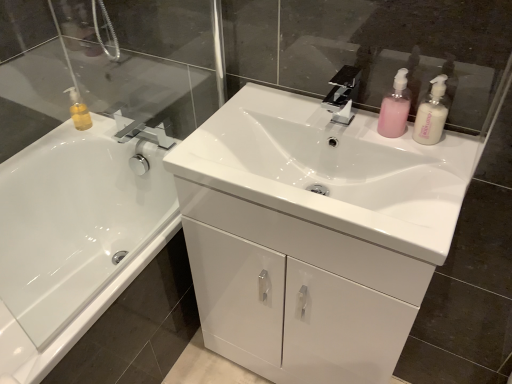
Question: Should I look upward or downward to see pink plastic pump bottle at upper right, marked as the 1th toiletry in a right-to-left arrangement?

Choices:
 (A) down
 (B) up

Answer: (B)

Question: Is white glossy sink at center facing towards black glossy faucet at center?

Choices:
 (A) yes
 (B) no

Answer: (B)

Question: Would you say black glossy faucet at center is part of white glossy sink at center's contents?

Choices:
 (A) no
 (B) yes

Answer: (A)

Question: Would you say white glossy sink at center is outside black glossy faucet at center?

Choices:
 (A) no
 (B) yes

Answer: (B)

Question: Considering the relative positions of white glossy sink at center and black glossy faucet at center in the image provided, is white glossy sink at center behind black glossy faucet at center?

Choices:
 (A) no
 (B) yes

Answer: (A)

Question: Is the surface of white glossy sink at center in direct contact with black glossy faucet at center?

Choices:
 (A) yes
 (B) no

Answer: (B)

Question: Is white glossy sink at center closer to camera compared to black glossy faucet at center?

Choices:
 (A) no
 (B) yes

Answer: (B)

Question: From the image's perspective, is white glossy bathtub at left located above pink matte pump bottle at upper right, which appears as the second toiletry when viewed from the back?

Choices:
 (A) yes
 (B) no

Answer: (B)

Question: Considering the relative sizes of white glossy bathtub at left and pink matte pump bottle at upper right, which is the 2th toiletry in right-to-left order, in the image provided, is white glossy bathtub at left wider than pink matte pump bottle at upper right, which is the 2th toiletry in right-to-left order,?

Choices:
 (A) no
 (B) yes

Answer: (B)

Question: From a real-world perspective, is white glossy bathtub at left physically above pink matte pump bottle at upper right, which appears as the second toiletry when viewed from the back?

Choices:
 (A) no
 (B) yes

Answer: (A)

Question: Is white glossy bathtub at left thinner than pink matte pump bottle at upper right, acting as the second toiletry starting from the left?

Choices:
 (A) yes
 (B) no

Answer: (B)

Question: From a real-world perspective, is white glossy bathtub at left located beneath pink matte pump bottle at upper right, the 2th toiletry positioned from the front?

Choices:
 (A) yes
 (B) no

Answer: (A)

Question: Is white glossy bathtub at left outside pink matte pump bottle at upper right, acting as the second toiletry starting from the left?

Choices:
 (A) yes
 (B) no

Answer: (A)

Question: Is pink plastic pump bottle at upper right, marked as the 1th toiletry in a right-to-left arrangement, smaller than white glossy sink at center?

Choices:
 (A) no
 (B) yes

Answer: (B)